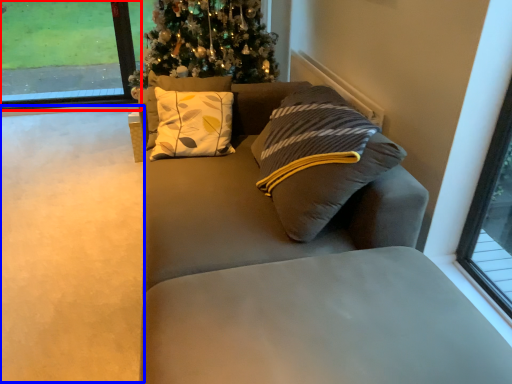
Question: Which of the following is the closest to the observer, window (highlighted by a red box) or golf course (highlighted by a blue box)?

Choices:
 (A) window
 (B) golf course

Answer: (B)